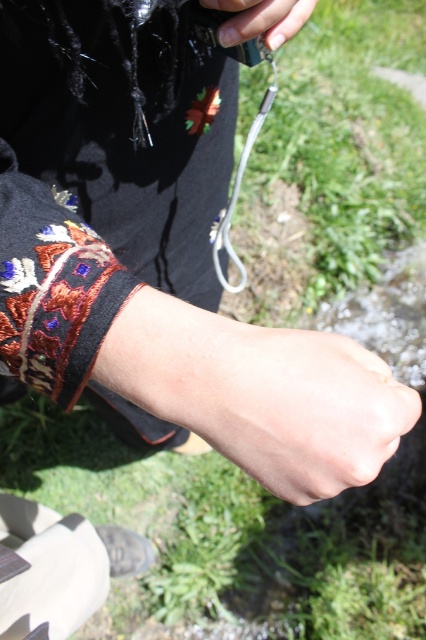
Can you confirm if dry skin at center is positioned to the right of nail polish at center?

Correct, you'll find dry skin at center to the right of nail polish at center.

Is point (259, 429) more distant than point (213, 8)?

No, it is not.

The width and height of the screenshot is (426, 640). Describe the element at coordinates (299, 406) in the screenshot. I see `dry skin at center` at that location.

The image size is (426, 640). I want to click on dry skin at center, so click(299, 406).